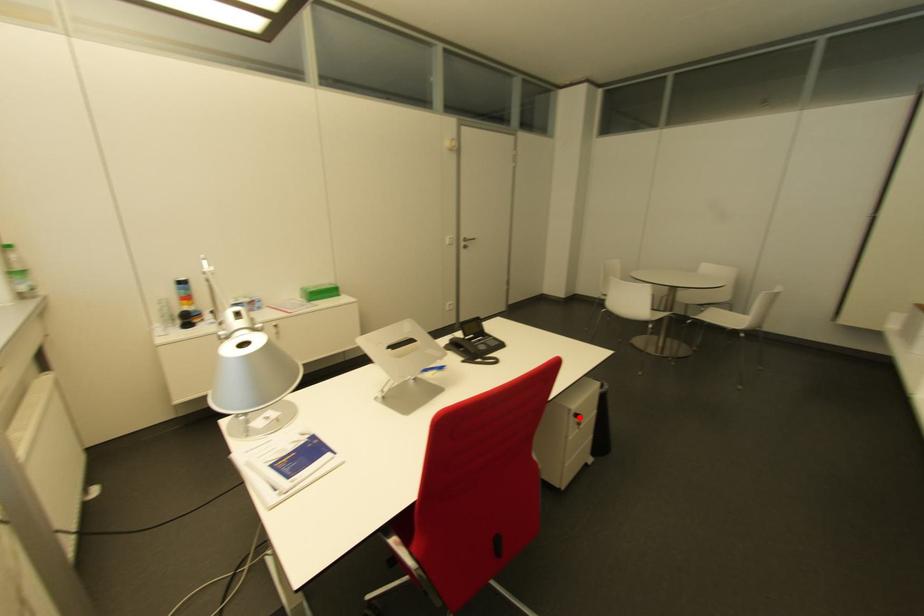
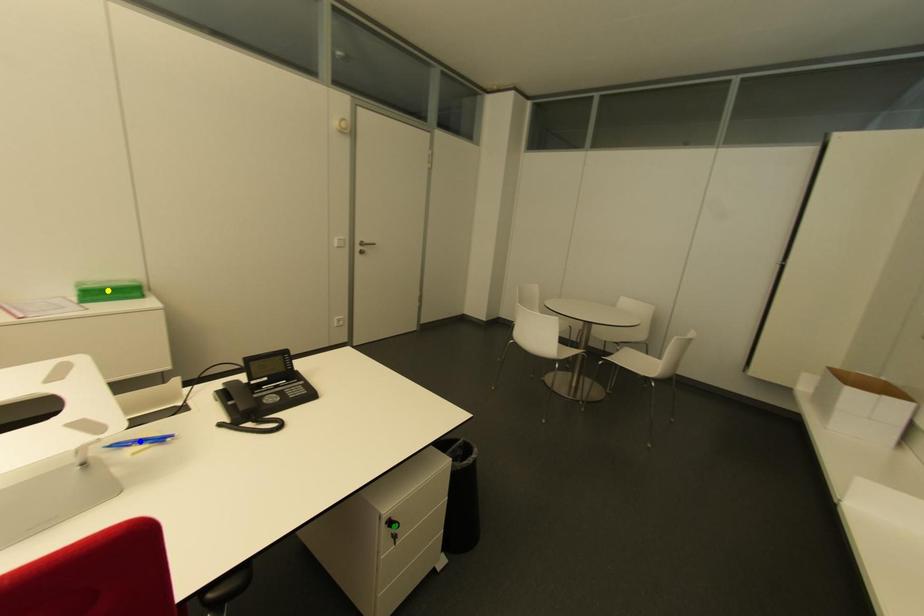
Question: I am providing you with two images of the same scene from different viewpoints. A red point is marked on the first image. You are given multiple points on the second image. Which mark in image 2 goes with the point in image 1?

Choices:
 (A) green point
 (B) yellow point
 (C) blue point

Answer: (A)